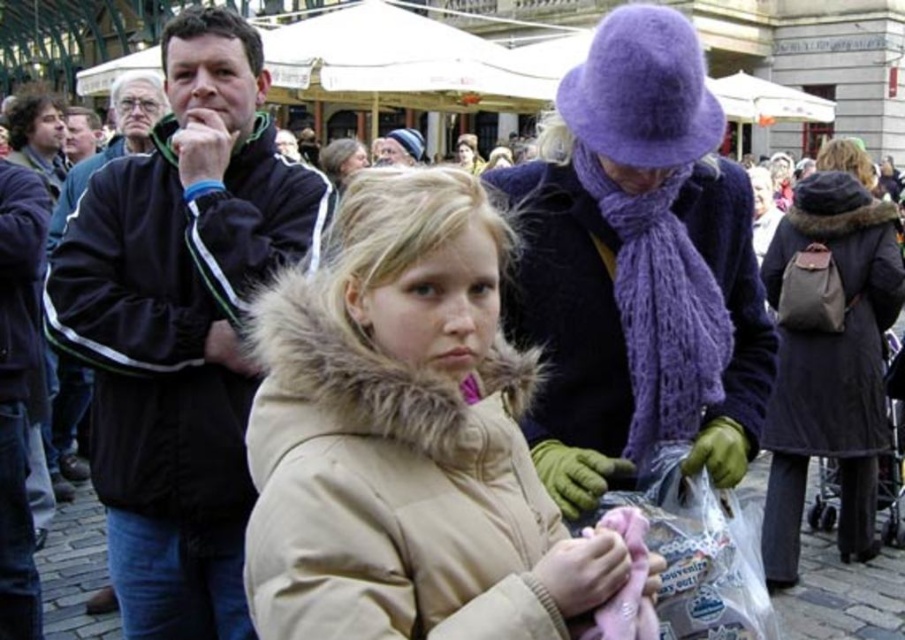
Who is more distant from viewer, [726,481] or [794,541]?

The point [794,541] is behind.

Is purple woolen hat at upper center wider than dark brown leather coat at center?

Correct, the width of purple woolen hat at upper center exceeds that of dark brown leather coat at center.

You are a GUI agent. You are given a task and a screenshot of the screen. Output one action in this format:
    pyautogui.click(x=<x>, y=<y>)
    Task: Click on the purple woolen hat at upper center
    The width and height of the screenshot is (905, 640).
    Given the screenshot: What is the action you would take?
    pyautogui.click(x=637, y=269)

In the scene shown: Is purple woolen hat at upper center closer to the viewer compared to black fleece jacket at left?

Yes, it is.

Describe the element at coordinates (637, 269) in the screenshot. I see `purple woolen hat at upper center` at that location.

Where is `purple woolen hat at upper center`? purple woolen hat at upper center is located at coordinates (637, 269).

The width and height of the screenshot is (905, 640). Identify the location of purple woolen hat at upper center. (637, 269).

Who is positioned more to the left, tan fur-lined coat at center or dark brown leather coat at center?

Positioned to the left is tan fur-lined coat at center.

Does tan fur-lined coat at center appear on the left side of dark brown leather coat at center?

Yes, tan fur-lined coat at center is to the left of dark brown leather coat at center.

You are a GUI agent. You are given a task and a screenshot of the screen. Output one action in this format:
    pyautogui.click(x=<x>, y=<y>)
    Task: Click on the tan fur-lined coat at center
    The width and height of the screenshot is (905, 640).
    Given the screenshot: What is the action you would take?
    pyautogui.click(x=405, y=436)